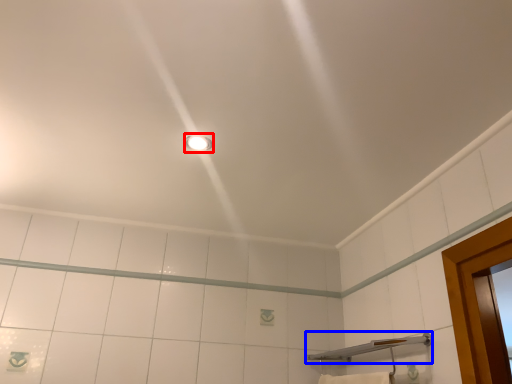
Question: Which of the following is the closest to the observer, light fixture (highlighted by a red box) or shower (highlighted by a blue box)?

Choices:
 (A) light fixture
 (B) shower

Answer: (B)